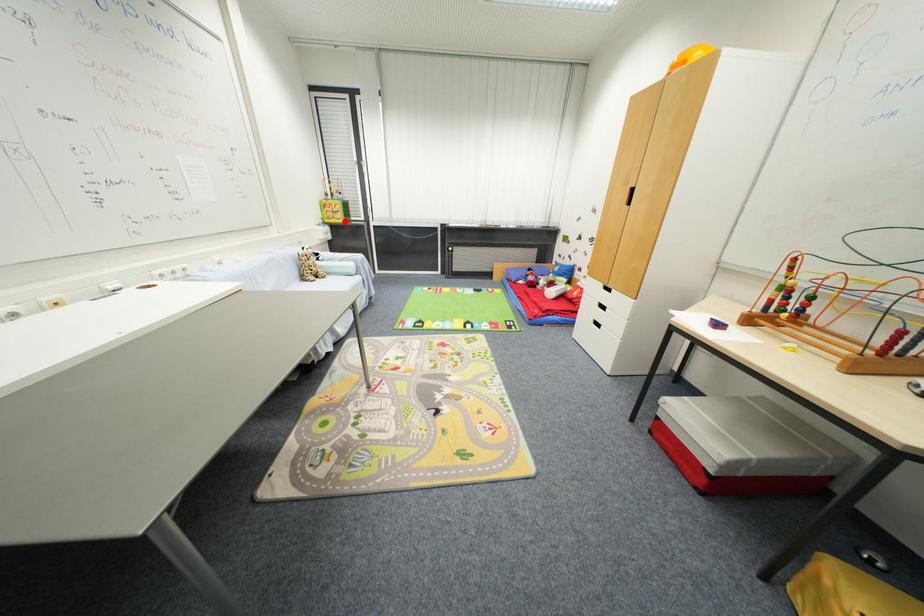
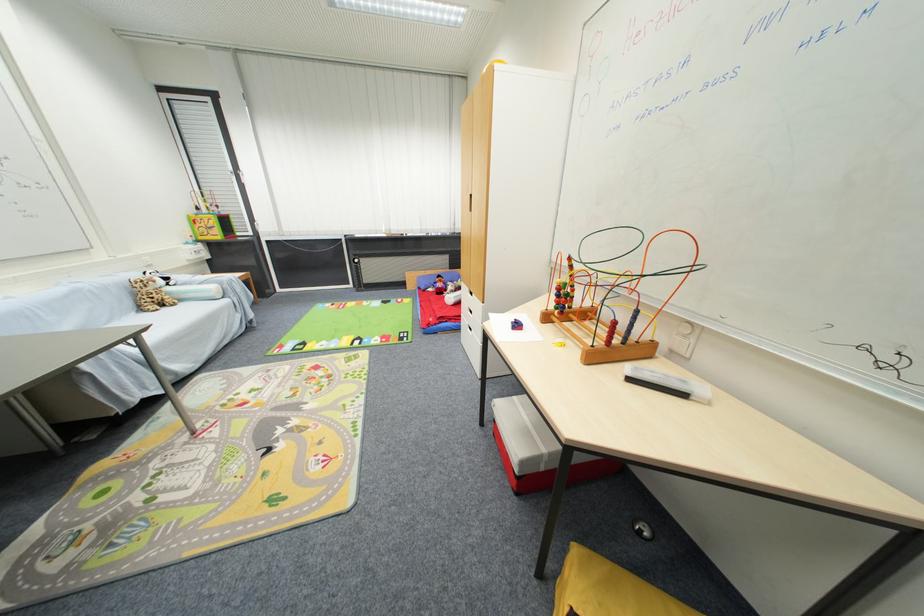
Locate, in the second image, the point that corresponds to the highlighted location in the first image.

(223, 238)